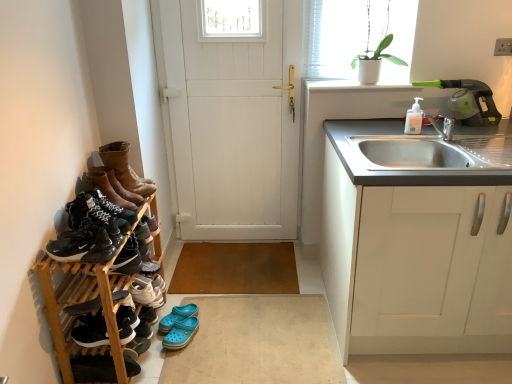
Question: Is green plastic vacuum cleaner at upper right bigger than black matte sneakers at lower left, acting as the sixth footwear starting from the bottom?

Choices:
 (A) yes
 (B) no

Answer: (A)

Question: From the image's perspective, would you say green plastic vacuum cleaner at upper right is positioned over black matte sneakers at lower left, marked as the fifth footwear in a top-to-bottom arrangement?

Choices:
 (A) no
 (B) yes

Answer: (B)

Question: From a real-world perspective, is green plastic vacuum cleaner at upper right over black matte sneakers at lower left, acting as the sixth footwear starting from the bottom?

Choices:
 (A) yes
 (B) no

Answer: (A)

Question: Considering the relative positions of green plastic vacuum cleaner at upper right and black matte sneakers at lower left, acting as the sixth footwear starting from the bottom, in the image provided, is green plastic vacuum cleaner at upper right in front of black matte sneakers at lower left, acting as the sixth footwear starting from the bottom,?

Choices:
 (A) no
 (B) yes

Answer: (A)

Question: From a real-world perspective, is green plastic vacuum cleaner at upper right positioned under black matte sneakers at lower left, marked as the fifth footwear in a top-to-bottom arrangement, based on gravity?

Choices:
 (A) yes
 (B) no

Answer: (B)

Question: Is black matte sneakers at lower left, acting as the sixth footwear starting from the bottom, a part of green plastic vacuum cleaner at upper right?

Choices:
 (A) yes
 (B) no

Answer: (B)

Question: Does blue rubber clogs at lower center, arranged as the third footwear when ordered from the bottom, have a larger size compared to shiny black sneakers at left, which appears as the 4th footwear when viewed from the top?

Choices:
 (A) no
 (B) yes

Answer: (B)

Question: Is blue rubber clogs at lower center, arranged as the third footwear when ordered from the bottom, oriented towards shiny black sneakers at left, which appears as the 4th footwear when viewed from the top?

Choices:
 (A) yes
 (B) no

Answer: (B)

Question: Does blue rubber clogs at lower center, arranged as the third footwear when ordered from the bottom, have a smaller size compared to shiny black sneakers at left, the seventh footwear positioned from the bottom?

Choices:
 (A) yes
 (B) no

Answer: (B)

Question: Does blue rubber clogs at lower center, arranged as the third footwear when ordered from the bottom, appear on the left side of shiny black sneakers at left, the seventh footwear positioned from the bottom?

Choices:
 (A) no
 (B) yes

Answer: (A)

Question: Does blue rubber clogs at lower center, arranged as the third footwear when ordered from the bottom, appear on the right side of shiny black sneakers at left, the seventh footwear positioned from the bottom?

Choices:
 (A) no
 (B) yes

Answer: (B)

Question: Does blue rubber clogs at lower center, arranged as the third footwear when ordered from the bottom, have a lesser height compared to shiny black sneakers at left, the seventh footwear positioned from the bottom?

Choices:
 (A) yes
 (B) no

Answer: (A)

Question: Is black suede shoe at lower left, positioned as the first footwear in bottom-to-top order, at the left side of leather boots at left, the first footwear positioned from the top?

Choices:
 (A) no
 (B) yes

Answer: (A)